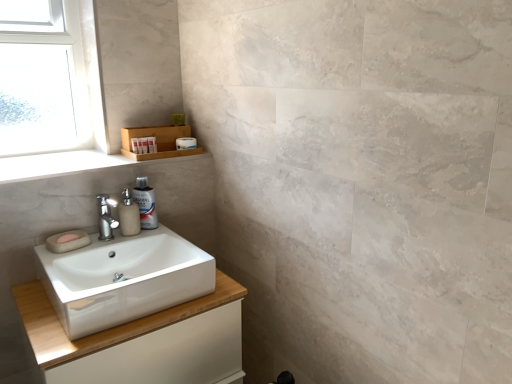
Locate an element on the screen. free spot to the right of white matte container at upper left, which is counted as the second toiletry, starting from the back is located at coordinates coord(162,157).